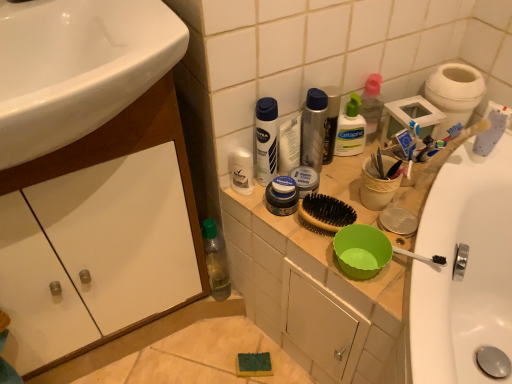
At what (x,y) coordinates should I click in order to perform the action: click on free space in front of clear plastic bottle at upper center, which is the first toiletry from right to left. Please return your answer as a coordinate pair (x, y). Looking at the image, I should click on (353, 185).